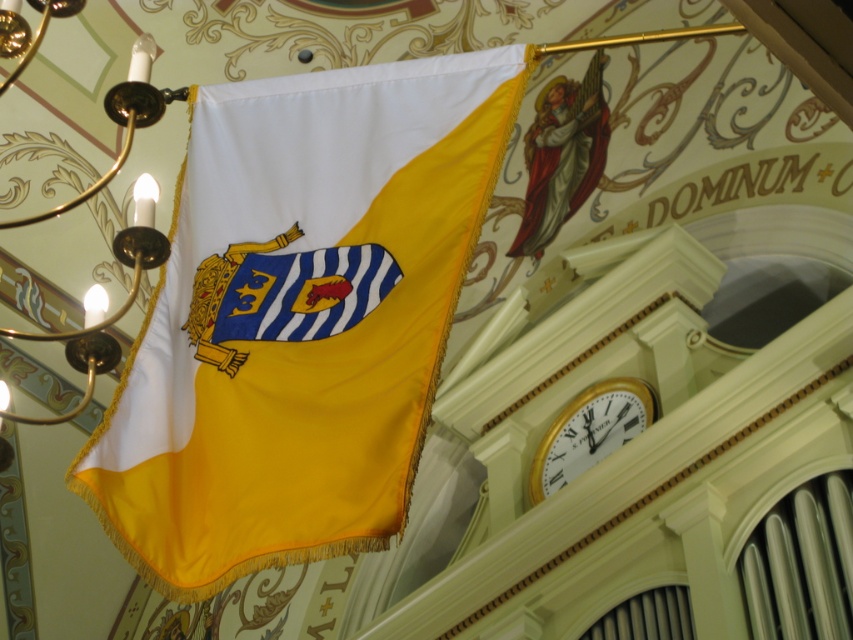
Who is positioned more to the left, yellow satin flag at center or white glossy clock at upper right?

yellow satin flag at center

Can you confirm if yellow satin flag at center is taller than white glossy clock at upper right?

Yes.

Between point (421, 262) and point (621, 412), which one is positioned behind?

The point (621, 412) is behind.

Find the location of `yellow satin flag at center`. yellow satin flag at center is located at coordinates (299, 317).

Which is in front, point (242, 113) or point (80, 340)?

Point (242, 113) is more forward.

Who is positioned more to the left, yellow satin flag at center or gold-bronze chandelier at upper left?

From the viewer's perspective, gold-bronze chandelier at upper left appears more on the left side.

Between point (497, 172) and point (39, 26), which one is positioned behind?

Point (39, 26)

Locate an element on the screen. yellow satin flag at center is located at coordinates (299, 317).

Does gold-bronze chandelier at upper left have a greater width compared to white glossy clock at upper right?

Indeed, gold-bronze chandelier at upper left has a greater width compared to white glossy clock at upper right.

Locate an element on the screen. gold-bronze chandelier at upper left is located at coordinates (115, 310).